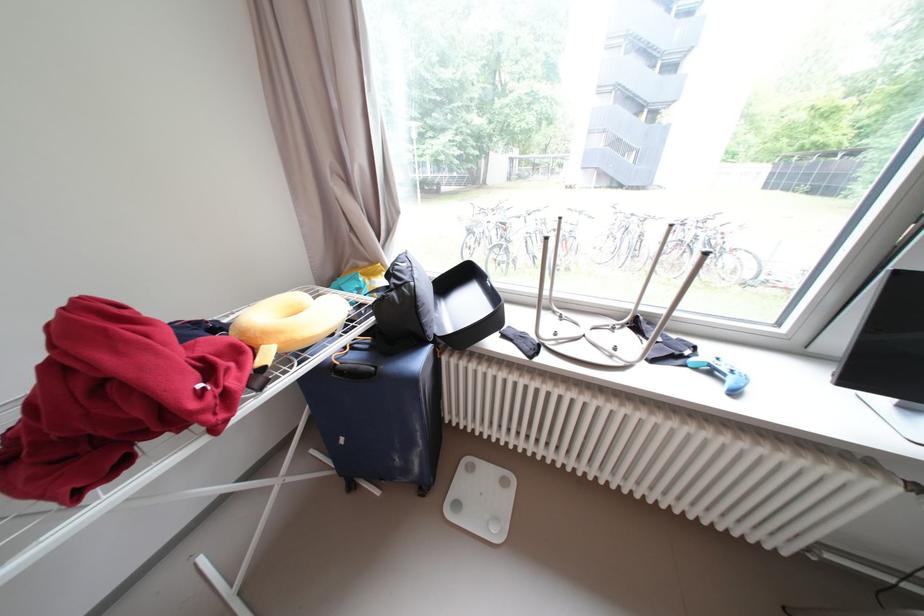
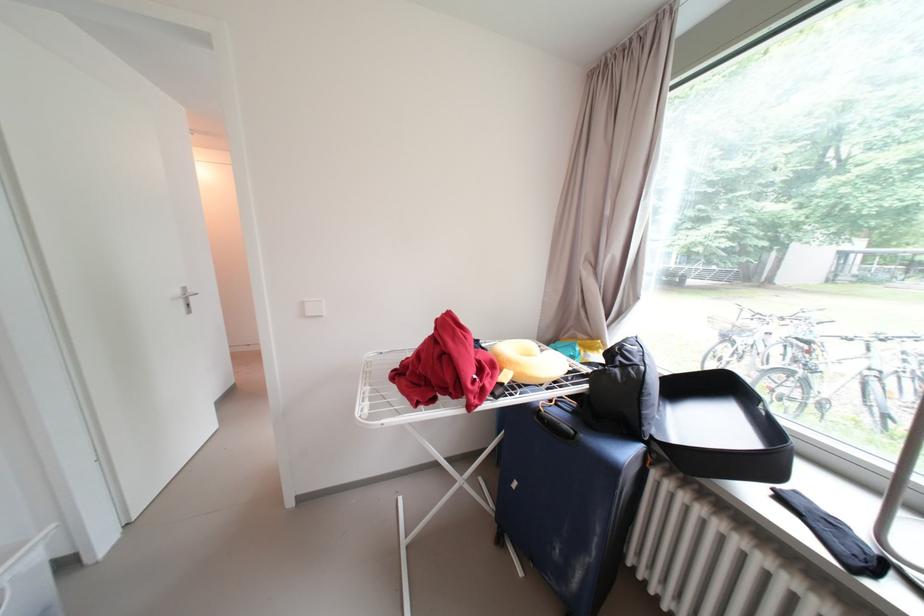
Question: The camera is either moving clockwise (left) or counter-clockwise (right) around the object. The first image is from the beginning of the video and the second image is from the end. Is the camera moving left or right when shooting the video?

Choices:
 (A) Left
 (B) Right

Answer: (B)